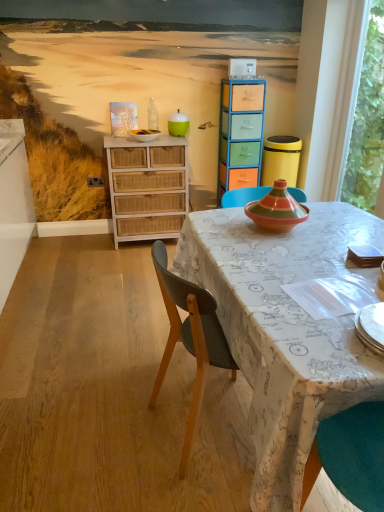
Question: Can you see white wicker dresser at left touching black plastic power outlet at lower left?

Choices:
 (A) yes
 (B) no

Answer: (B)

Question: Does white wicker dresser at left come behind black plastic power outlet at lower left?

Choices:
 (A) yes
 (B) no

Answer: (B)

Question: From a real-world perspective, is white wicker dresser at left on top of black plastic power outlet at lower left?

Choices:
 (A) yes
 (B) no

Answer: (B)

Question: Considering the relative sizes of white wicker dresser at left and black plastic power outlet at lower left in the image provided, is white wicker dresser at left wider than black plastic power outlet at lower left?

Choices:
 (A) no
 (B) yes

Answer: (B)

Question: Is black plastic power outlet at lower left inside white wicker dresser at left?

Choices:
 (A) no
 (B) yes

Answer: (A)

Question: From a real-world perspective, is white wicker dresser at left beneath black plastic power outlet at lower left?

Choices:
 (A) yes
 (B) no

Answer: (A)

Question: Does black plastic power outlet at lower left have a smaller size compared to translucent glass bottle at center?

Choices:
 (A) no
 (B) yes

Answer: (B)

Question: Does black plastic power outlet at lower left have a larger size compared to translucent glass bottle at center?

Choices:
 (A) yes
 (B) no

Answer: (B)

Question: From the image's perspective, would you say black plastic power outlet at lower left is shown under translucent glass bottle at center?

Choices:
 (A) no
 (B) yes

Answer: (B)

Question: From a real-world perspective, is black plastic power outlet at lower left physically below translucent glass bottle at center?

Choices:
 (A) no
 (B) yes

Answer: (B)

Question: Considering the relative sizes of black plastic power outlet at lower left and translucent glass bottle at center in the image provided, is black plastic power outlet at lower left thinner than translucent glass bottle at center?

Choices:
 (A) no
 (B) yes

Answer: (B)

Question: Is translucent glass bottle at center a part of black plastic power outlet at lower left?

Choices:
 (A) yes
 (B) no

Answer: (B)

Question: From a real-world perspective, is translucent glass bottle at center located higher than map-patterned fabric at center?

Choices:
 (A) no
 (B) yes

Answer: (B)